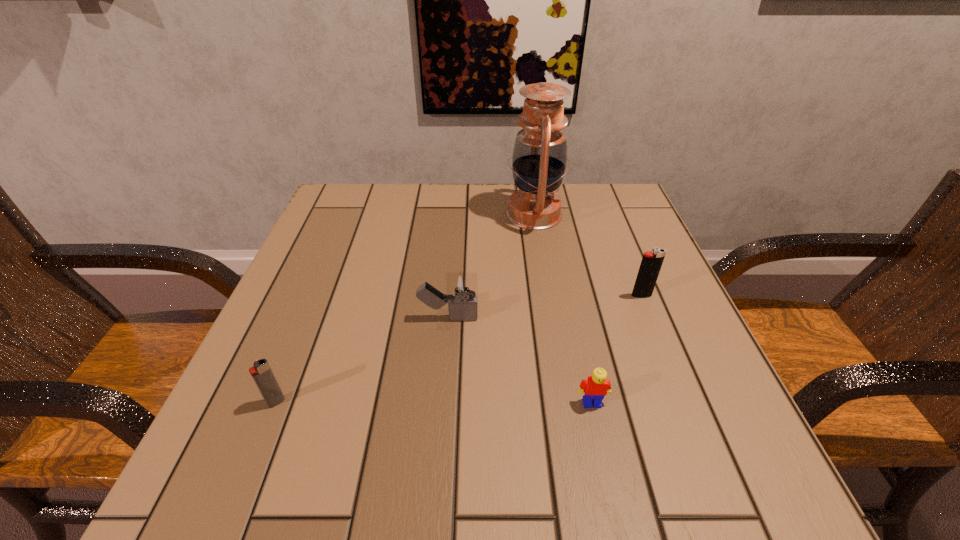
You are a GUI agent. You are given a task and a screenshot of the screen. Output one action in this format:
    pyautogui.click(x=<x>, y=<y>)
    Task: Click on the farthest object
    The height and width of the screenshot is (540, 960).
    Given the screenshot: What is the action you would take?
    pyautogui.click(x=539, y=158)

Image resolution: width=960 pixels, height=540 pixels. Identify the location of oil lamp. (539, 158).

The image size is (960, 540). Identify the location of the rightmost igniter. (651, 263).

This screenshot has height=540, width=960. Identify the location of the fourth nearest object. coord(651,263).

Identify the location of the third nearest object. Image resolution: width=960 pixels, height=540 pixels. (462, 290).

Locate an element on the screen. This screenshot has width=960, height=540. the second igniter from left to right is located at coordinates (462, 290).

Where is `the leftmost object`? This screenshot has width=960, height=540. the leftmost object is located at coordinates (261, 372).

This screenshot has height=540, width=960. I want to click on the leftmost igniter, so click(261, 372).

This screenshot has height=540, width=960. I want to click on Lego, so click(x=594, y=389).

I want to click on blank space located on the left of the tallest object, so click(424, 214).